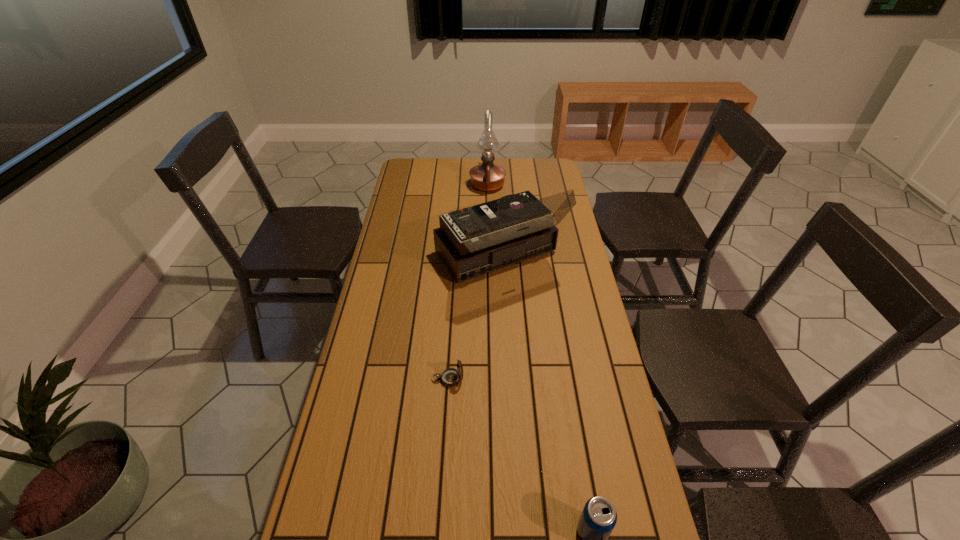
The image size is (960, 540). I want to click on vacant space at the left edge of the desktop, so pos(407,203).

Where is `blank area at the right edge`? The height and width of the screenshot is (540, 960). blank area at the right edge is located at coordinates coord(554,365).

Find the location of a particular element. vacant area at the far left corner is located at coordinates [x=431, y=177].

I want to click on free space between the shortest object and the oil lamp, so (468, 282).

What are the coordinates of `empty space between the farthest object and the compass` in the screenshot? It's located at (468, 282).

At what (x,y) coordinates should I click in order to perform the action: click on unoccupied position between the third nearest object and the shortest object. Please return your answer as a coordinate pair (x, y). Image resolution: width=960 pixels, height=540 pixels. Looking at the image, I should click on (473, 319).

What are the coordinates of `object identified as the second closest to the farthest object` in the screenshot? It's located at 450,377.

What are the coordinates of `object that stands as the third closest to the record player` in the screenshot? It's located at (598, 518).

Identify the location of free space that satisfies the following two spatial constraints: 1. on the front side of the record player; 2. on the right side of the farthest object. The width and height of the screenshot is (960, 540). (490, 259).